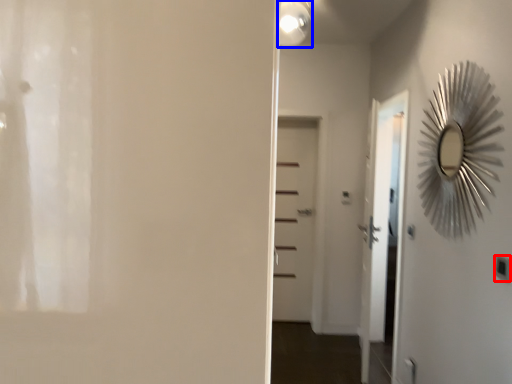
Question: Which object is further to the camera taking this photo, light switch (highlighted by a red box) or light fixture (highlighted by a blue box)?

Choices:
 (A) light switch
 (B) light fixture

Answer: (B)